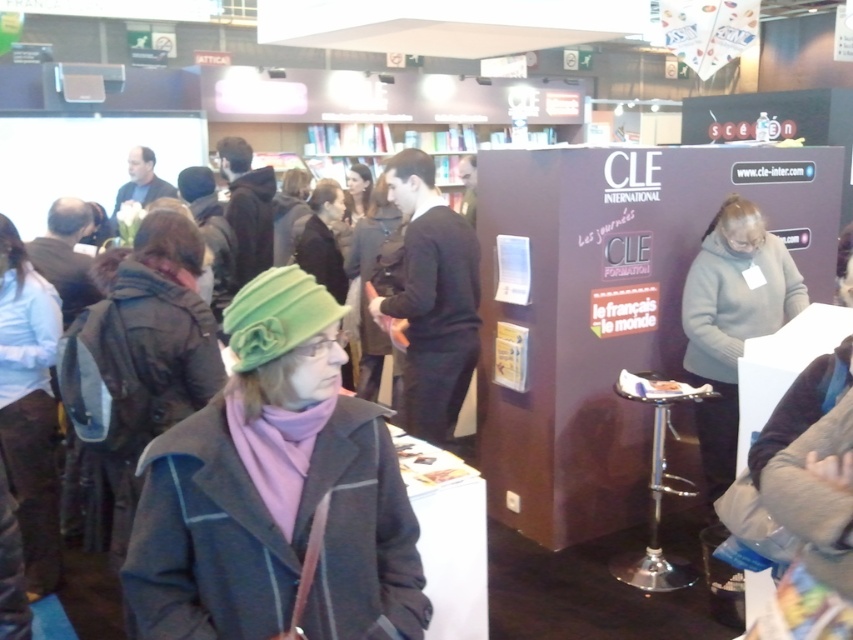
What are the coordinates of the gray fuzzy sweater at right?

The gray fuzzy sweater at right is located at coordinates point (732,321).

You are a photographer at the event and want to capture both the green felt hat at center and the green woolen hat at center in a single shot. Which hat will appear larger in the photo?

The green felt hat at center will appear larger in the photo because it is closer to the viewer than the green woolen hat at center.